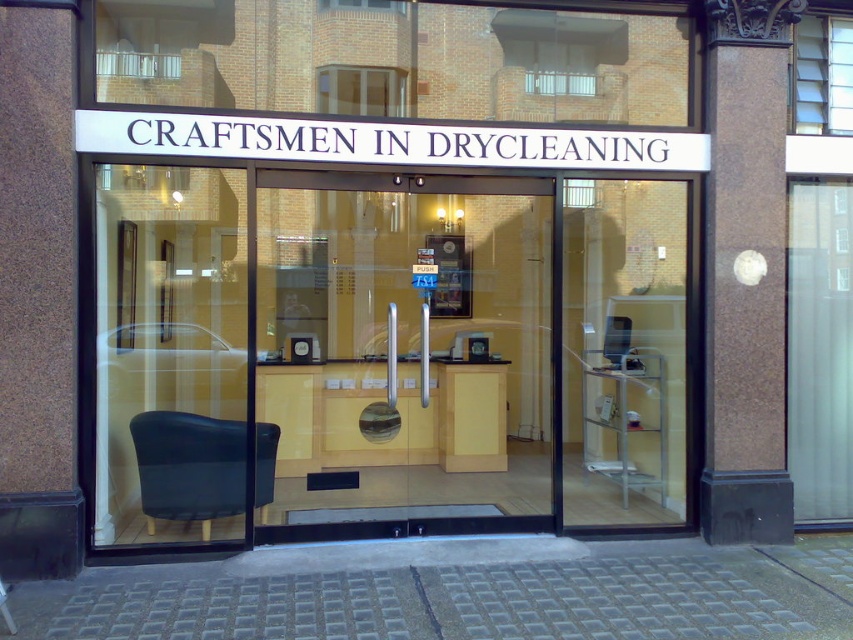
Is transparent glass door at center below matte black chair at left?

Actually, transparent glass door at center is above matte black chair at left.

Who is more distant from viewer, (427, 426) or (268, 442)?

The point (427, 426) is behind.

Identify the location of transparent glass door at center. The image size is (853, 640). (404, 346).

Can you confirm if matte wood counter at center is shorter than matte black chair at left?

Incorrect, matte wood counter at center's height does not fall short of matte black chair at left's.

Describe the element at coordinates (410, 316) in the screenshot. I see `matte wood counter at center` at that location.

What do you see at coordinates (410, 316) in the screenshot? The width and height of the screenshot is (853, 640). I see `matte wood counter at center` at bounding box center [410, 316].

The width and height of the screenshot is (853, 640). What are the coordinates of `matte wood counter at center` in the screenshot? It's located at (410, 316).

Which is more to the right, matte wood counter at center or transparent glass door at left?

matte wood counter at center is more to the right.

Is point (94, 120) farther from viewer compared to point (242, 330)?

No, it is in front of (242, 330).

You are a GUI agent. You are given a task and a screenshot of the screen. Output one action in this format:
    pyautogui.click(x=<x>, y=<y>)
    Task: Click on the matte wood counter at center
    Image resolution: width=853 pixels, height=640 pixels.
    Given the screenshot: What is the action you would take?
    pyautogui.click(x=410, y=316)